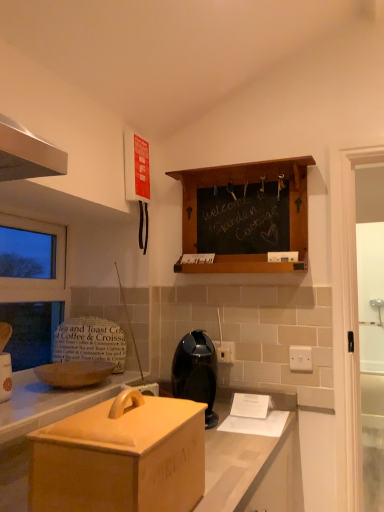
Describe the element at coordinates (254, 468) in the screenshot. I see `matte wooden bread bin at lower left` at that location.

In order to face white plastic electric outlet at center, the second electric outlet from the right, should I rotate leftwards or rightwards?

It's best to rotate right around 4.411 degrees.

Find the location of a particular element. white plastic electric outlet at center, which appears as the first electric outlet when viewed from the left is located at coordinates coord(225,351).

This screenshot has height=512, width=384. Describe the element at coordinates (300, 358) in the screenshot. I see `white plastic electric outlet at upper right, which appears as the 2th electric outlet when viewed from the left` at that location.

Identify the location of transparent glass window at left. (32, 288).

In order to face wooden chalkboard at center, should I rotate leftwards or rightwards?

You should look right and rotate roughly 6.193 degrees.

Where is `matte wooden bread bin at lower left`? The image size is (384, 512). matte wooden bread bin at lower left is located at coordinates (254, 468).

In terms of height, does wooden chalkboard at center look taller or shorter compared to white plastic electric outlet at upper right, acting as the first electric outlet starting from the front?

wooden chalkboard at center is taller than white plastic electric outlet at upper right, acting as the first electric outlet starting from the front.

Is wooden chalkboard at center to the left or to the right of white plastic electric outlet at upper right, marked as the 2th electric outlet in a back-to-front arrangement, in the image?

Clearly, wooden chalkboard at center is on the left of white plastic electric outlet at upper right, marked as the 2th electric outlet in a back-to-front arrangement, in the image.

Which is less distant, (181, 177) or (295, 351)?

The point (295, 351) is closer.

Find the location of a particular element. This screenshot has width=384, height=512. cabinetry above the white plastic electric outlet at upper right, which appears as the 2th electric outlet when viewed from the left (from the image's perspective) is located at coordinates (242, 183).

Can you confirm if white plastic electric outlet at center, positioned as the 1th electric outlet in back-to-front order, is bigger than matte wooden bread bin at lower left?

Actually, white plastic electric outlet at center, positioned as the 1th electric outlet in back-to-front order, might be smaller than matte wooden bread bin at lower left.

Is white plastic electric outlet at center, which appears as the first electric outlet when viewed from the left, not near matte wooden bread bin at lower left?

white plastic electric outlet at center, which appears as the first electric outlet when viewed from the left, is actually quite close to matte wooden bread bin at lower left.

Is white plastic electric outlet at center, acting as the second electric outlet starting from the front, inside or outside of matte wooden bread bin at lower left?

The correct answer is: outside.

Does white plastic electric outlet at upper right, which appears as the 2th electric outlet when viewed from the left, appear on the right side of wooden chalkboard at center?

Yes, white plastic electric outlet at upper right, which appears as the 2th electric outlet when viewed from the left, is to the right of wooden chalkboard at center.

Between white plastic electric outlet at upper right, marked as the first electric outlet in a right-to-left arrangement, and wooden chalkboard at center, which one has more height?

With more height is wooden chalkboard at center.

From a real-world perspective, which object stands above the other?

From a 3D spatial view, wooden chalkboard at center is above.

Considering the positions of objects white plastic electric outlet at upper right, which appears as the 2th electric outlet when viewed from the left, and wooden chalkboard at center in the image provided, who is behind, white plastic electric outlet at upper right, which appears as the 2th electric outlet when viewed from the left, or wooden chalkboard at center?

Positioned behind is white plastic electric outlet at upper right, which appears as the 2th electric outlet when viewed from the left.

Looking at this image, is transparent glass door at right at the back of black plastic coffee maker at center?

No, black plastic coffee maker at center is not facing away from transparent glass door at right.

Can you confirm if black plastic coffee maker at center is positioned to the left of transparent glass door at right?

Yes.

From the image's perspective, would you say black plastic coffee maker at center is shown under transparent glass door at right?

Actually, black plastic coffee maker at center appears above transparent glass door at right in the image.

Considering the sizes of objects black plastic coffee maker at center and transparent glass door at right in the image provided, who is thinner, black plastic coffee maker at center or transparent glass door at right?

transparent glass door at right.

Looking at this image, considering their positions, is matte wooden bread bin at lower left located in front of or behind white plastic electric outlet at upper right, marked as the 2th electric outlet in a back-to-front arrangement?

In the image, matte wooden bread bin at lower left appears in front of white plastic electric outlet at upper right, marked as the 2th electric outlet in a back-to-front arrangement.

From the image's perspective, between matte wooden bread bin at lower left and white plastic electric outlet at upper right, marked as the first electric outlet in a right-to-left arrangement, which one is located above?

white plastic electric outlet at upper right, marked as the first electric outlet in a right-to-left arrangement.

In the scene shown: Does matte wooden bread bin at lower left have a larger size compared to white plastic electric outlet at upper right, acting as the first electric outlet starting from the front?

Indeed, matte wooden bread bin at lower left has a larger size compared to white plastic electric outlet at upper right, acting as the first electric outlet starting from the front.

Is matte wooden bread bin at lower left turned away from white plastic electric outlet at upper right, acting as the first electric outlet starting from the front?

No, matte wooden bread bin at lower left's orientation is not away from white plastic electric outlet at upper right, acting as the first electric outlet starting from the front.

Considering the sizes of objects transparent glass door at right and white plastic electric outlet at center, acting as the second electric outlet starting from the front, in the image provided, who is taller, transparent glass door at right or white plastic electric outlet at center, acting as the second electric outlet starting from the front,?

Standing taller between the two is transparent glass door at right.

Can you confirm if transparent glass door at right is bigger than white plastic electric outlet at center, positioned as the 1th electric outlet in back-to-front order?

Correct, transparent glass door at right is larger in size than white plastic electric outlet at center, positioned as the 1th electric outlet in back-to-front order.

In the image, is transparent glass door at right on the left side or the right side of white plastic electric outlet at center, the second electric outlet from the right?

transparent glass door at right is to the right of white plastic electric outlet at center, the second electric outlet from the right.

Which of these two, wooden chalkboard at center or black plastic coffee maker at center, is wider?

black plastic coffee maker at center.

From the image's perspective, which is above, wooden chalkboard at center or black plastic coffee maker at center?

From the image's view, wooden chalkboard at center is above.

Between wooden chalkboard at center and black plastic coffee maker at center, which one appears on the left side from the viewer's perspective?

black plastic coffee maker at center.

Looking at this image, could you tell me if wooden chalkboard at center is turned towards black plastic coffee maker at center?

No, wooden chalkboard at center is not facing towards black plastic coffee maker at center.

The image size is (384, 512). There is a white plastic electric outlet at upper right, marked as the 2th electric outlet in a back-to-front arrangement. What are the coordinates of `cabinetry above it (from a real-world perspective)` in the screenshot? It's located at (242, 183).

Locate an element on the screen. This screenshot has width=384, height=512. countertop located on the left of white plastic electric outlet at center, acting as the second electric outlet starting from the front is located at coordinates [254, 468].

Considering their positions, is white plastic electric outlet at center, positioned as the 1th electric outlet in back-to-front order, positioned further to transparent glass window at left than white plastic electric outlet at upper right, marked as the 2th electric outlet in a back-to-front arrangement?

white plastic electric outlet at upper right, marked as the 2th electric outlet in a back-to-front arrangement, is further to transparent glass window at left.

Looking at the image, which one is located further to matte wooden bread bin at lower left, black plastic coffee maker at center or wooden chalkboard at center?

Among the two, wooden chalkboard at center is located further to matte wooden bread bin at lower left.

Based on their spatial positions, is black plastic coffee maker at center or white plastic electric outlet at center, which appears as the first electric outlet when viewed from the left, further from matte wooden bread bin at lower left?

white plastic electric outlet at center, which appears as the first electric outlet when viewed from the left, is further to matte wooden bread bin at lower left.

From the image, which object appears to be farther from white plastic electric outlet at upper right, marked as the 2th electric outlet in a back-to-front arrangement, white plastic electric outlet at center, acting as the second electric outlet starting from the front, or black plastic coffee maker at center?

Based on the image, black plastic coffee maker at center appears to be further to white plastic electric outlet at upper right, marked as the 2th electric outlet in a back-to-front arrangement.

Looking at this image, from the image, which object appears to be farther from transparent glass door at right, wooden chalkboard at center or matte wooden bread bin at lower left?

Among the two, matte wooden bread bin at lower left is located further to transparent glass door at right.

From the image, which object appears to be farther from wooden chalkboard at center, transparent glass window at left or white plastic electric outlet at upper right, acting as the first electric outlet starting from the front?

Among the two, transparent glass window at left is located further to wooden chalkboard at center.

From the image, which object appears to be farther from black plastic coffee maker at center, transparent glass window at left or white plastic electric outlet at upper right, marked as the first electric outlet in a right-to-left arrangement?

Based on the image, transparent glass window at left appears to be further to black plastic coffee maker at center.

Which object lies nearer to the anchor point white plastic electric outlet at upper right, which appears as the 2th electric outlet when viewed from the left, black plastic coffee maker at center or matte wooden bread bin at lower left?

black plastic coffee maker at center is positioned closer to the anchor white plastic electric outlet at upper right, which appears as the 2th electric outlet when viewed from the left.

Identify the location of window screen positioned between matte wooden bread bin at lower left and transparent glass door at right from near to far. (32, 288).

You are a GUI agent. You are given a task and a screenshot of the screen. Output one action in this format:
    pyautogui.click(x=<x>, y=<y>)
    Task: Click on the appliance located between transparent glass window at left and white plastic electric outlet at upper right, which appears as the 2th electric outlet when viewed from the left, in the left-right direction
    Image resolution: width=384 pixels, height=512 pixels.
    Given the screenshot: What is the action you would take?
    pyautogui.click(x=196, y=372)

Where is `appliance located between transparent glass window at left and wooden chalkboard at center in the left-right direction`? This screenshot has width=384, height=512. appliance located between transparent glass window at left and wooden chalkboard at center in the left-right direction is located at coordinates (196, 372).

Identify the location of appliance between matte wooden bread bin at lower left and transparent glass window at left from front to back. The image size is (384, 512). (196, 372).